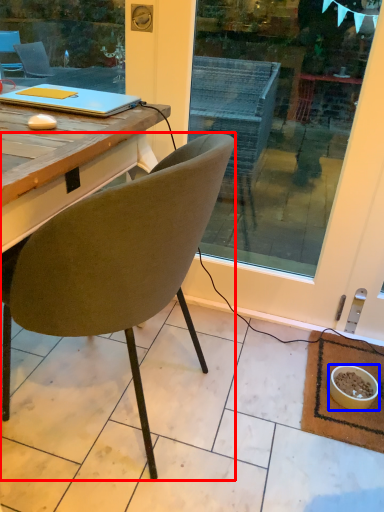
Question: Which object is closer to the camera taking this photo, chair (highlighted by a red box) or bowl (highlighted by a blue box)?

Choices:
 (A) chair
 (B) bowl

Answer: (A)